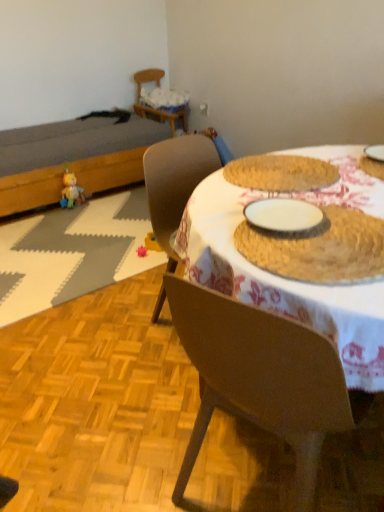
Identify the location of vacant space behind pink fabric toy at lower center, the 2th toy when ordered from back to front. (134, 241).